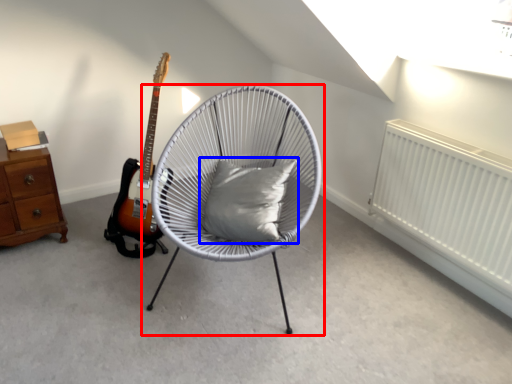
Question: Which object appears farthest to the camera in this image, chair (highlighted by a red box) or pillow (highlighted by a blue box)?

Choices:
 (A) chair
 (B) pillow

Answer: (B)